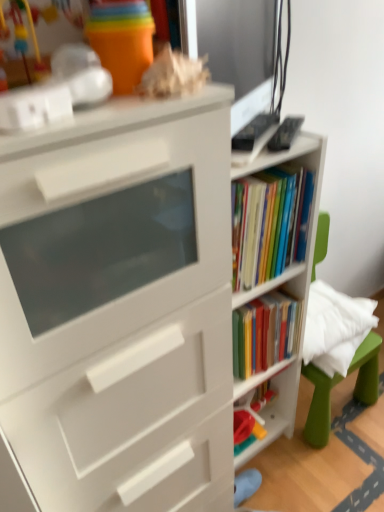
Question: From the image's perspective, is white matte bookshelf at center, the 2th shelf ordered from the bottom, under green plastic swivel chair at right?

Choices:
 (A) no
 (B) yes

Answer: (A)

Question: Can you confirm if white matte bookshelf at center, the 2th shelf ordered from the bottom, is taller than green plastic swivel chair at right?

Choices:
 (A) no
 (B) yes

Answer: (B)

Question: Is white matte bookshelf at center, marked as the 1th shelf in a top-to-bottom arrangement, behind green plastic swivel chair at right?

Choices:
 (A) yes
 (B) no

Answer: (B)

Question: From a real-world perspective, is white matte bookshelf at center, marked as the 1th shelf in a top-to-bottom arrangement, under green plastic swivel chair at right?

Choices:
 (A) yes
 (B) no

Answer: (B)

Question: Does white matte bookshelf at center, the 2th shelf ordered from the bottom, turn towards green plastic swivel chair at right?

Choices:
 (A) yes
 (B) no

Answer: (B)

Question: From the image's perspective, does white matte bookshelf at center, the 2th shelf ordered from the bottom, appear higher than green plastic swivel chair at right?

Choices:
 (A) no
 (B) yes

Answer: (B)

Question: From the image's perspective, is plastic toy at center, arranged as the 1th shelf when ordered from the bottom, beneath matte black monitor at upper right?

Choices:
 (A) no
 (B) yes

Answer: (B)

Question: Are plastic toy at center, which ranks as the 2th shelf in top-to-bottom order, and matte black monitor at upper right making contact?

Choices:
 (A) yes
 (B) no

Answer: (B)

Question: Could you tell me if plastic toy at center, which ranks as the 2th shelf in top-to-bottom order, is turned towards matte black monitor at upper right?

Choices:
 (A) no
 (B) yes

Answer: (A)

Question: Is matte black monitor at upper right a part of plastic toy at center, arranged as the 1th shelf when ordered from the bottom?

Choices:
 (A) no
 (B) yes

Answer: (A)

Question: Does plastic toy at center, arranged as the 1th shelf when ordered from the bottom, come behind matte black monitor at upper right?

Choices:
 (A) no
 (B) yes

Answer: (B)

Question: Is plastic toy at center, which ranks as the 2th shelf in top-to-bottom order, in front of matte black monitor at upper right?

Choices:
 (A) no
 (B) yes

Answer: (A)

Question: From the image's perspective, does green plastic swivel chair at right appear lower than plastic toy at center, arranged as the 1th shelf when ordered from the bottom?

Choices:
 (A) yes
 (B) no

Answer: (B)